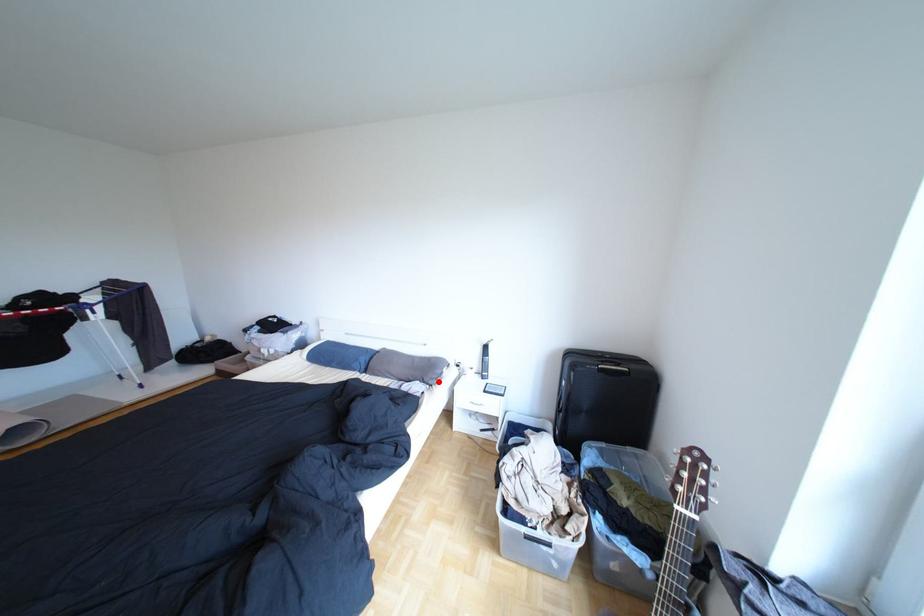
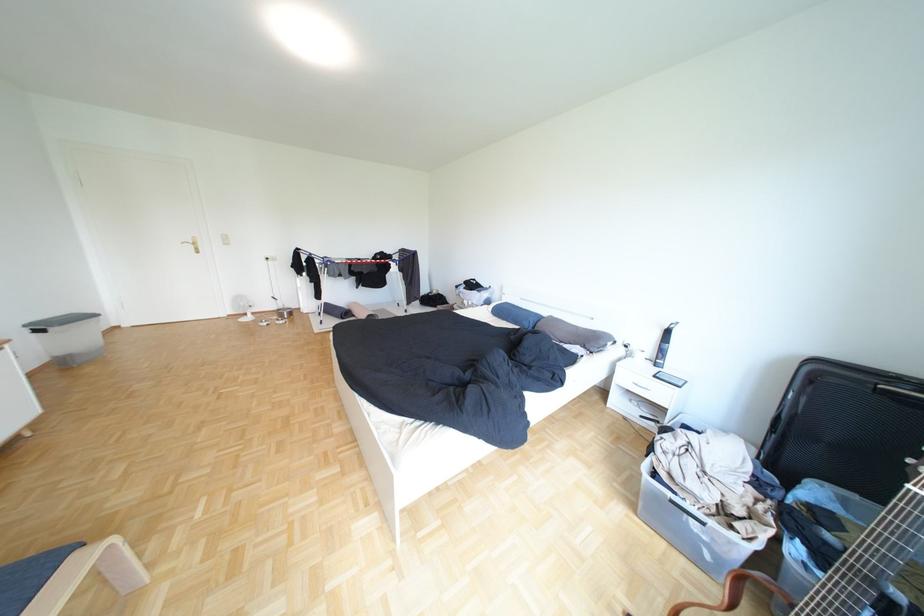
The point at the highlighted location is marked in the first image. Where is the corresponding point in the second image?

(600, 347)